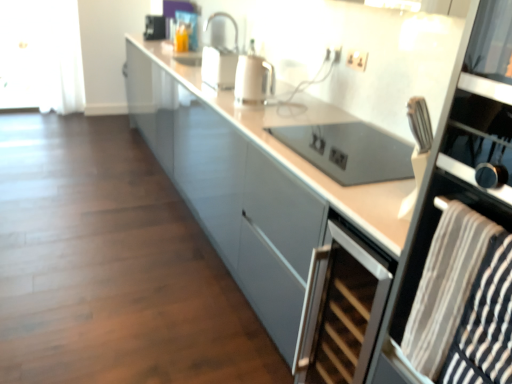
Question: Is white glossy kettle at center outside of black glass oven at right?

Choices:
 (A) no
 (B) yes

Answer: (B)

Question: Considering the relative positions of white glossy kettle at center and black glass oven at right in the image provided, is white glossy kettle at center to the left of black glass oven at right from the viewer's perspective?

Choices:
 (A) yes
 (B) no

Answer: (A)

Question: Is the depth of white glossy kettle at center greater than that of black glass oven at right?

Choices:
 (A) yes
 (B) no

Answer: (A)

Question: Does white glossy kettle at center have a greater width compared to black glass oven at right?

Choices:
 (A) no
 (B) yes

Answer: (A)

Question: Is white glossy kettle at center at the right side of black glass oven at right?

Choices:
 (A) yes
 (B) no

Answer: (B)

Question: From a real-world perspective, is white sheer curtain at left physically located above or below white plastic electric outlet at upper center, the second electric outlet from the front?

Choices:
 (A) above
 (B) below

Answer: (B)

Question: Considering the relative positions of white sheer curtain at left and white plastic electric outlet at upper center, the second electric outlet from the front, in the image provided, is white sheer curtain at left to the left or to the right of white plastic electric outlet at upper center, the second electric outlet from the front,?

Choices:
 (A) right
 (B) left

Answer: (B)

Question: Is white sheer curtain at left wider or thinner than white plastic electric outlet at upper center, which is counted as the second electric outlet, starting from the right?

Choices:
 (A) thin
 (B) wide

Answer: (B)

Question: Is point (57, 62) positioned closer to the camera than point (335, 56)?

Choices:
 (A) closer
 (B) farther

Answer: (B)

Question: Based on their sizes in the image, would you say striped fabric towel at right is bigger or smaller than white sheer curtain at left?

Choices:
 (A) big
 (B) small

Answer: (B)

Question: Is striped fabric towel at right wider or thinner than white sheer curtain at left?

Choices:
 (A) wide
 (B) thin

Answer: (B)

Question: Is striped fabric towel at right inside the boundaries of white sheer curtain at left, or outside?

Choices:
 (A) inside
 (B) outside

Answer: (B)

Question: Considering the relative positions of striped fabric towel at right and white sheer curtain at left in the image provided, is striped fabric towel at right to the left or to the right of white sheer curtain at left?

Choices:
 (A) right
 (B) left

Answer: (A)

Question: Considering the positions of point (412, 256) and point (157, 16), is point (412, 256) closer or farther from the camera than point (157, 16)?

Choices:
 (A) closer
 (B) farther

Answer: (A)

Question: Is black glass oven at right bigger or smaller than metallic silver toaster at upper center, the first appliance in the left-to-right sequence?

Choices:
 (A) small
 (B) big

Answer: (B)